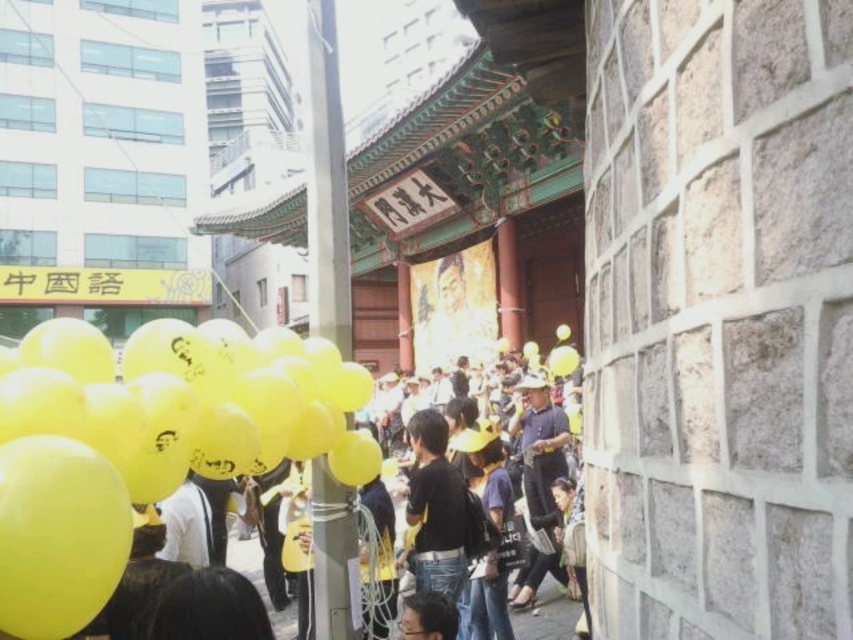
You are attending a festival and see a yellow matte balloon at center and a black matte shirt at center. Which object is located to the left when viewed from the front?

The yellow matte balloon at center is positioned on the left side of the black matte shirt at center, so it is located to the left.

You are at an event and see the yellow matte balloon at center and the metallic silver pole at center. Which object is positioned lower in the scene?

The yellow matte balloon at center is located below the metallic silver pole at center, so it is positioned lower.